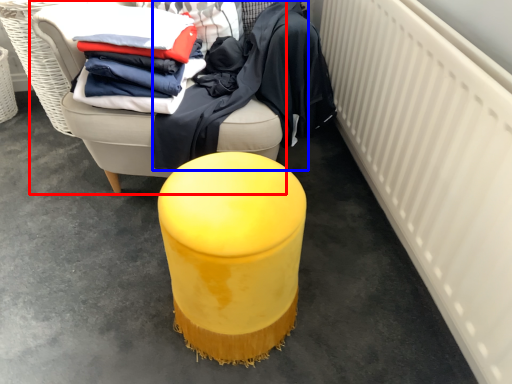
Question: Which object appears closest to the camera in this image, furniture (highlighted by a red box) or clothing (highlighted by a blue box)?

Choices:
 (A) furniture
 (B) clothing

Answer: (A)